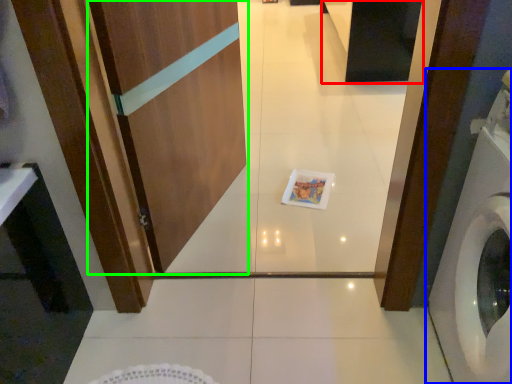
Question: Considering the real-world distances, which object is farthest from cabinetry (highlighted by a red box)? washing machine (highlighted by a blue box) or screen door (highlighted by a green box)?

Choices:
 (A) washing machine
 (B) screen door

Answer: (A)